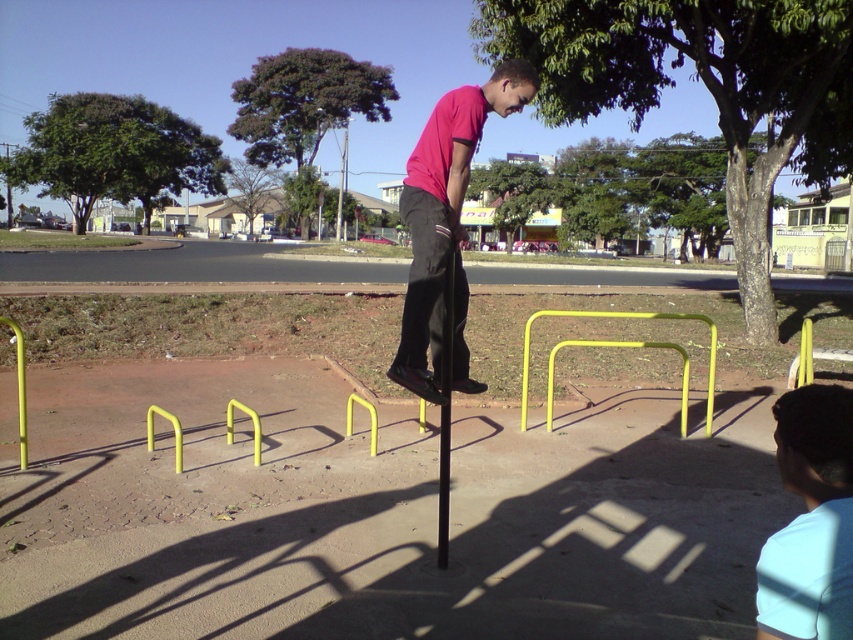
You are a painter who needs to know the relative sizes of the light blue fabric at lower right and the yellow matte hurdle at center in the image. Which one is wider?

The light blue fabric at lower right is less wide than the yellow matte hurdle at center.

You are standing at the camera position and want to pick up the light blue fabric at lower right. Is it within your immediate reach without moving your feet?

The light blue fabric at lower right and camera are 5.93 feet apart, so it is not within immediate reach without moving your feet since the distance is greater than an average person can reach comfortably.

You are designing a safety barrier that needs to be wider than both the matte pink shirt at center and the yellow matte hurdle at center. What is the minimum width the barrier should have?

The matte pink shirt at center is less wide than the yellow matte hurdle at center. Therefore, the barrier must be wider than the yellow matte hurdle at center to accommodate both objects.